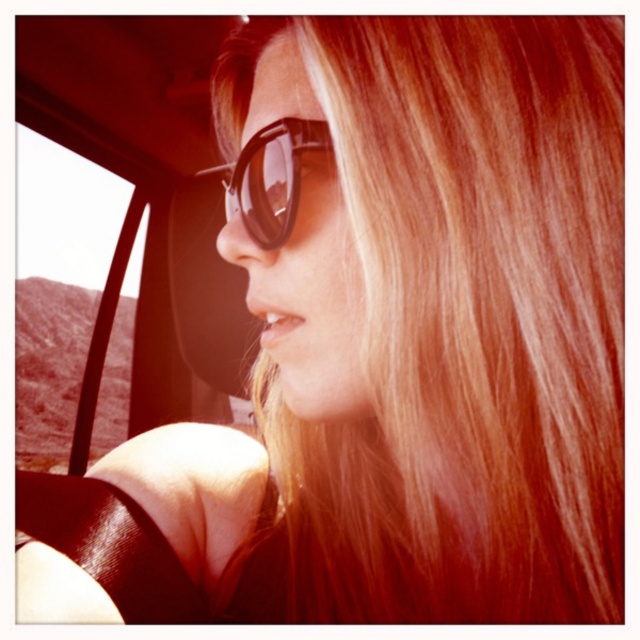
Is transparent glass car window at left positioned behind black plastic goggles at center?

Yes, it is.

Does point (65, 244) come in front of point (225, 218)?

No, (65, 244) is further to viewer.

Image resolution: width=640 pixels, height=640 pixels. I want to click on transparent glass car window at left, so click(x=77, y=243).